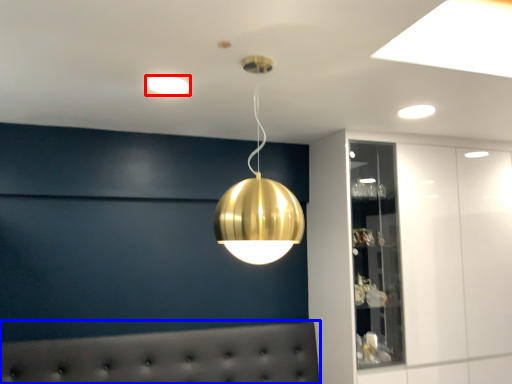
Question: Among these objects, which one is farthest to the camera, lamp (highlighted by a red box) or furniture (highlighted by a blue box)?

Choices:
 (A) lamp
 (B) furniture

Answer: (B)